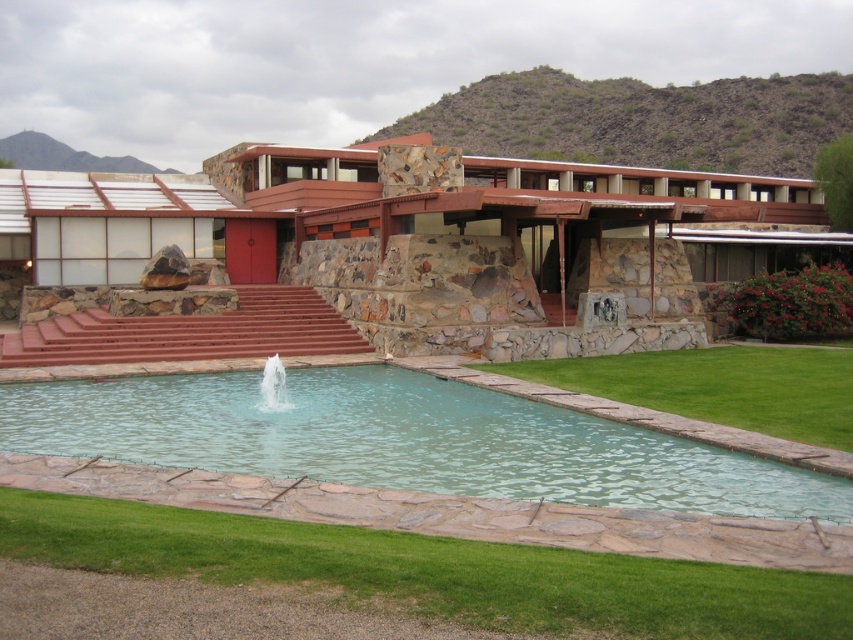
Question: Based on their relative distances, which object is farther from the clear glass water at center?

Choices:
 (A) green grass at lower center
 (B) green grass at lower right
 (C) clear glass pool at center

Answer: (A)

Question: Where is green grass at lower right located in relation to clear glass water at center in the image?

Choices:
 (A) above
 (B) below

Answer: (A)

Question: Considering the relative positions of clear glass pool at center and clear glass water at center in the image provided, where is clear glass pool at center located with respect to clear glass water at center?

Choices:
 (A) left
 (B) right

Answer: (B)

Question: Is the position of green grass at lower right more distant than that of clear glass water at center?

Choices:
 (A) yes
 (B) no

Answer: (B)

Question: Which of these objects is positioned farthest from the green grass at lower right?

Choices:
 (A) clear glass pool at center
 (B) green grass at lower center
 (C) clear glass water at center

Answer: (B)

Question: Which of these objects is positioned closest to the clear glass water at center?

Choices:
 (A) green grass at lower center
 (B) green grass at lower right

Answer: (B)